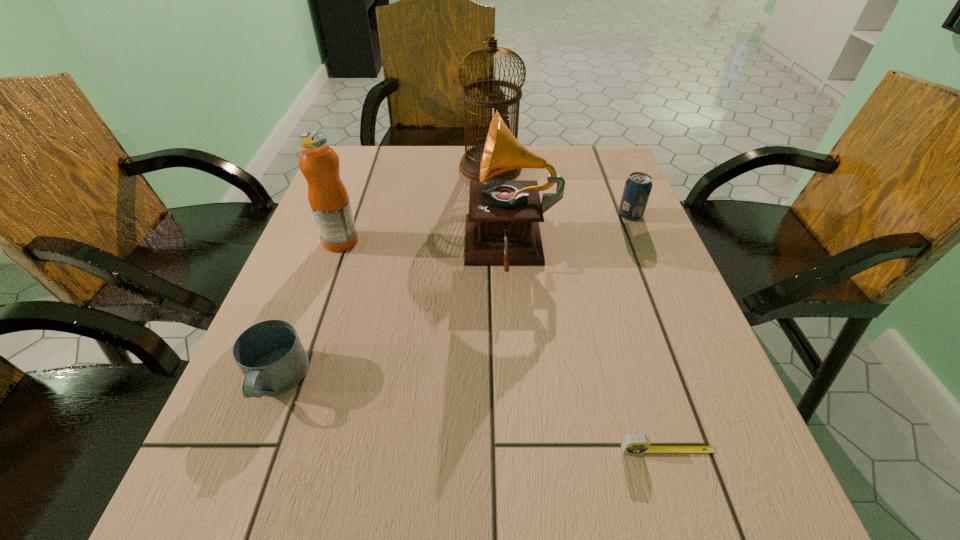
Image resolution: width=960 pixels, height=540 pixels. I want to click on mug positioned at the left edge, so click(270, 355).

Find the location of a particular element. pop soda at the right edge is located at coordinates (637, 189).

What are the coordinates of `tape measure that is positioned at the right edge` in the screenshot? It's located at (638, 443).

Locate an element on the screen. The width and height of the screenshot is (960, 540). vacant region at the far edge of the desktop is located at coordinates (414, 156).

This screenshot has height=540, width=960. I want to click on vacant space at the near edge of the desktop, so click(x=654, y=512).

The width and height of the screenshot is (960, 540). Identify the location of free space at the left edge. (299, 400).

Image resolution: width=960 pixels, height=540 pixels. What are the coordinates of `vacant space at the right edge` in the screenshot? It's located at [674, 288].

Image resolution: width=960 pixels, height=540 pixels. In the image, there is a desktop. Find the location of `vacant space at the far left corner`. vacant space at the far left corner is located at coordinates (354, 188).

In the image, there is a desktop. Find the location of `vacant space at the far right corner`. vacant space at the far right corner is located at coordinates (588, 185).

Image resolution: width=960 pixels, height=540 pixels. In the image, there is a desktop. In order to click on free space at the near right corner in this screenshot , I will do `click(677, 483)`.